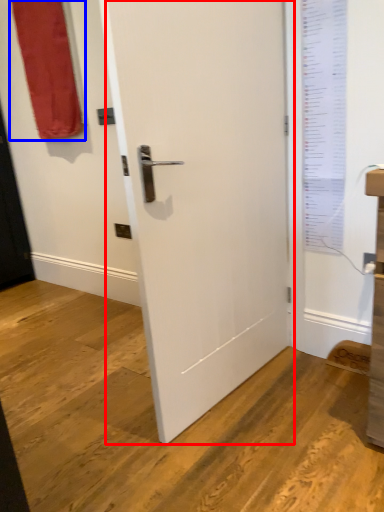
Question: Which of the following is the farthest to the observer, door (highlighted by a red box) or curtain (highlighted by a blue box)?

Choices:
 (A) door
 (B) curtain

Answer: (B)